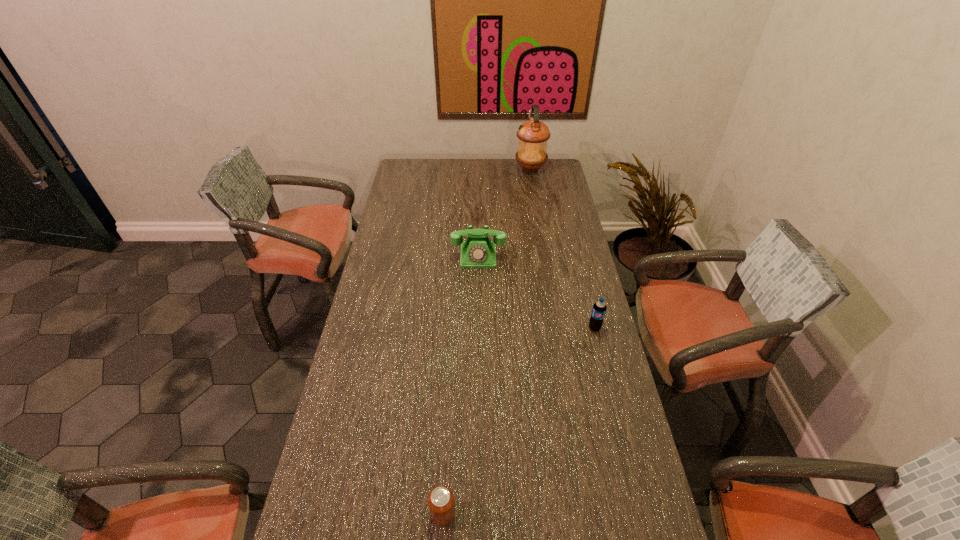
Find the location of a particular element. The height and width of the screenshot is (540, 960). blank area located on the back of the can is located at coordinates (450, 389).

The width and height of the screenshot is (960, 540). In order to click on object present at the far edge in this screenshot , I will do `click(533, 135)`.

This screenshot has height=540, width=960. Find the location of `oil lamp that is positioned at the right edge`. oil lamp that is positioned at the right edge is located at coordinates (533, 135).

Identify the location of soda bottle that is positioned at the right edge. Image resolution: width=960 pixels, height=540 pixels. (599, 308).

Locate an element on the screen. This screenshot has height=540, width=960. object that is positioned at the far right corner is located at coordinates (533, 135).

This screenshot has height=540, width=960. In the image, there is a desktop. What are the coordinates of `vacant space at the left edge` in the screenshot? It's located at (385, 222).

Identify the location of vacant area at the right edge of the desktop. (557, 291).

The height and width of the screenshot is (540, 960). In the image, there is a desktop. In order to click on vacant space at the far left corner in this screenshot , I will do `click(413, 163)`.

This screenshot has height=540, width=960. I want to click on empty location between the nearest object and the farthest object, so click(x=487, y=341).

This screenshot has height=540, width=960. Identify the location of free space that is in between the second nearest object and the nearest object. (518, 421).